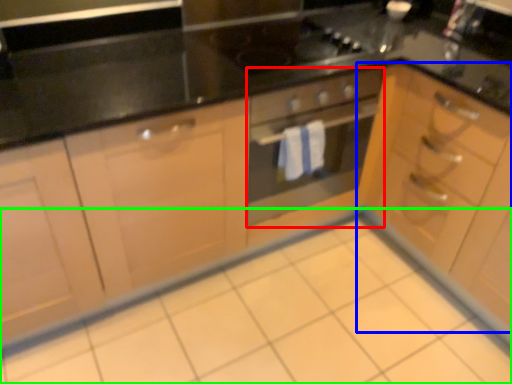
Question: Estimate the real-world distances between objects in this image. Which object is closer to oven (highlighted by a red box), cabinetry (highlighted by a blue box) or ceramic tile (highlighted by a green box)?

Choices:
 (A) cabinetry
 (B) ceramic tile

Answer: (A)